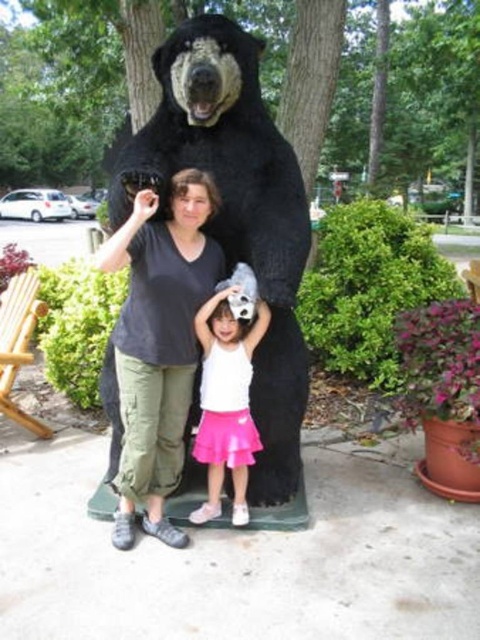
You are standing in front of the black furry bear at center. If you want to take a photo of the bear and the two people, where should you position yourself relative to the bear?

You should position yourself in front of the black furry bear at center so that the bear and the two people are visible in the photo.

You are taking a photo of the two people and the bear statue. You want to focus on the person on the left and the child. Which of the two points, point 1 at coordinates point (111, 456) or point 2 at coordinates point (229, 380), is closer to the camera and should be used for focusing to ensure both subjects are in clear view?

Point 1 at coordinates point (111, 456) is closer to the camera than point 2 at coordinates point (229, 380). Therefore, focusing on point 1 will ensure both subjects are in clear view since it is closer to the camera.